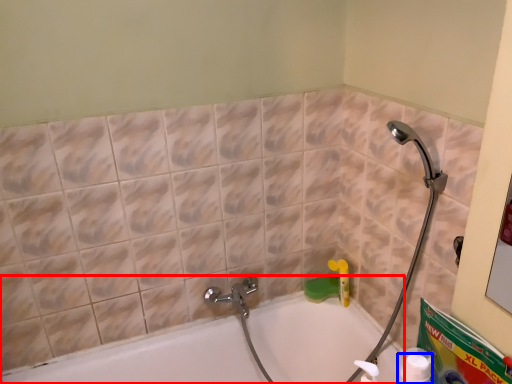
Question: Which object appears farthest to the camera in this image, bathtub (highlighted by a red box) or cleaning product (highlighted by a blue box)?

Choices:
 (A) bathtub
 (B) cleaning product

Answer: (A)